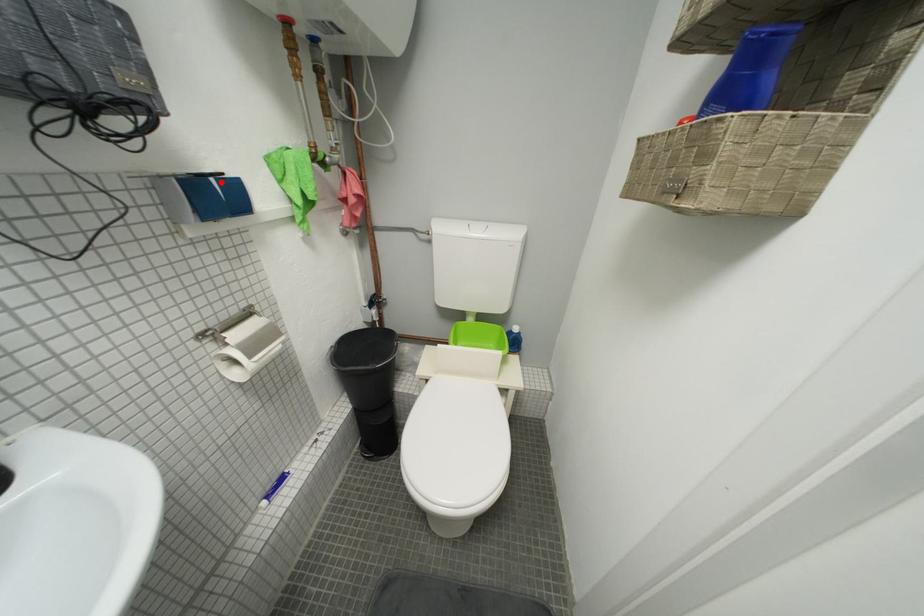
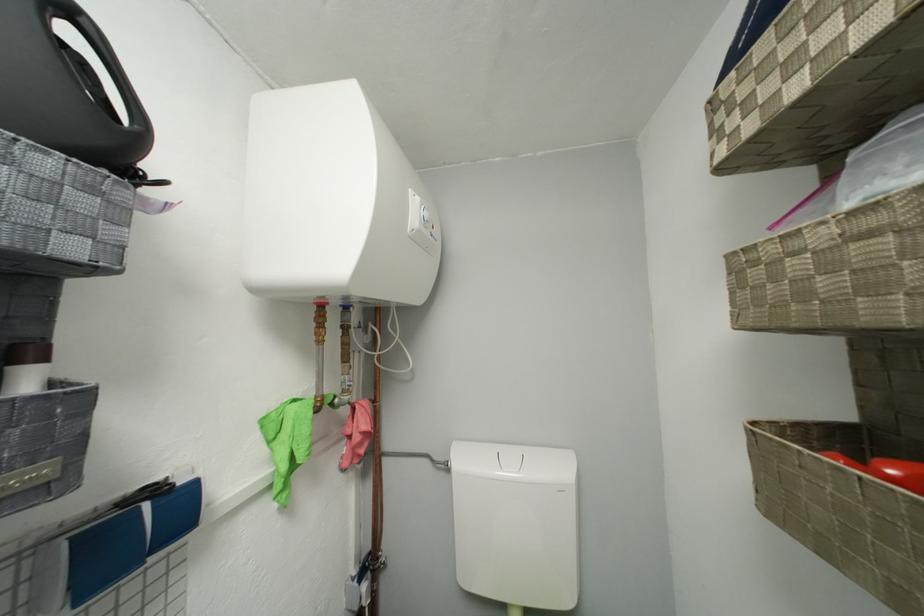
In the second image, find the point that corresponds to the highlighted location in the first image.

(155, 508)